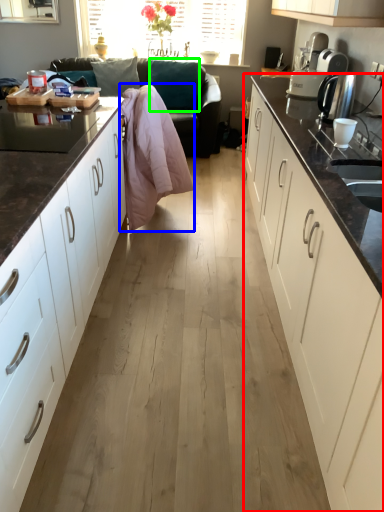
Question: Considering the real-world distances, which object is closest to cabinetry (highlighted by a red box)? blanket (highlighted by a blue box) or pillow (highlighted by a green box).

Choices:
 (A) blanket
 (B) pillow

Answer: (A)